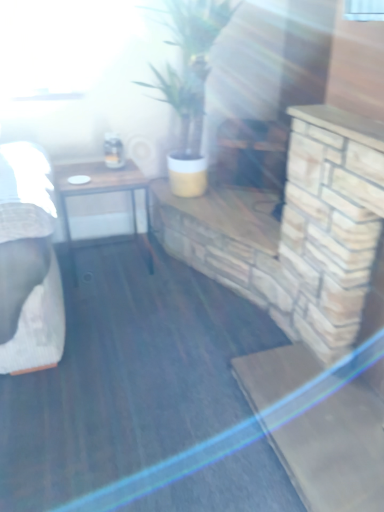
Find the location of `green matte plant at center`. green matte plant at center is located at coordinates (190, 85).

The height and width of the screenshot is (512, 384). Describe the element at coordinates (190, 85) in the screenshot. I see `green matte plant at center` at that location.

Where is `wooden table at left`? The width and height of the screenshot is (384, 512). wooden table at left is located at coordinates (98, 192).

The image size is (384, 512). What do you see at coordinates (98, 192) in the screenshot? I see `wooden table at left` at bounding box center [98, 192].

Where is `green matte plant at center`? The width and height of the screenshot is (384, 512). green matte plant at center is located at coordinates pos(190,85).

Which is more to the left, green matte plant at center or wooden table at left?

wooden table at left.

Is the position of green matte plant at center less distant than that of wooden table at left?

Yes, green matte plant at center is in front of wooden table at left.

Which is less distant, (187, 19) or (133, 182)?

Clearly, point (187, 19) is more distant from the camera than point (133, 182).

From the image's perspective, is green matte plant at center over wooden table at left?

Yes, from the image's perspective, green matte plant at center is over wooden table at left.

From a real-world perspective, does green matte plant at center sit lower than wooden table at left?

No.

Can you confirm if green matte plant at center is wider than wooden table at left?

Yes, green matte plant at center is wider than wooden table at left.

From their relative heights in the image, would you say green matte plant at center is taller or shorter than wooden table at left?

green matte plant at center is taller than wooden table at left.

Who is bigger, green matte plant at center or wooden table at left?

With larger size is green matte plant at center.

Could wooden table at left be considered to be inside green matte plant at center?

No, wooden table at left is not surrounded by green matte plant at center.

Does green matte plant at center touch wooden table at left?

There is a gap between green matte plant at center and wooden table at left.

Based on the photo, could you tell me if green matte plant at center is turned towards wooden table at left?

No, green matte plant at center is not aimed at wooden table at left.

Locate an element on the screen. The image size is (384, 512). houseplant in front of the wooden table at left is located at coordinates (190, 85).

Can you confirm if wooden table at left is positioned to the left of green matte plant at center?

Yes.

Is the depth of wooden table at left greater than that of green matte plant at center?

Yes, wooden table at left is further from the camera.

Is point (123, 176) behind point (164, 92)?

No, (123, 176) is in front of (164, 92).

From the image's perspective, between wooden table at left and green matte plant at center, who is located below?

wooden table at left.

From a real-world perspective, is wooden table at left physically above green matte plant at center?

No, from a real-world perspective, wooden table at left is not over green matte plant at center

Considering the relative sizes of wooden table at left and green matte plant at center in the image provided, is wooden table at left wider than green matte plant at center?

Incorrect, the width of wooden table at left does not surpass that of green matte plant at center.

Between wooden table at left and green matte plant at center, which one has less height?

wooden table at left.

Can you confirm if wooden table at left is smaller than green matte plant at center?

Yes, wooden table at left is smaller than green matte plant at center.

Choose the correct answer: Is wooden table at left inside green matte plant at center or outside it?

wooden table at left lies outside green matte plant at center.

Are wooden table at left and green matte plant at center making contact?

wooden table at left is not next to green matte plant at center, and they're not touching.

Could you tell me if wooden table at left is turned towards green matte plant at center?

No.

What's the angular difference between wooden table at left and green matte plant at center's facing directions?

0.954 degrees.

You are a GUI agent. You are given a task and a screenshot of the screen. Output one action in this format:
    pyautogui.click(x=<x>, y=<y>)
    Task: Click on the table that is behind the green matte plant at center
    The image size is (384, 512).
    Given the screenshot: What is the action you would take?
    pyautogui.click(x=98, y=192)

Identify the location of table beneath the green matte plant at center (from a real-world perspective). The width and height of the screenshot is (384, 512). (98, 192).

Find the location of a particular element. The image size is (384, 512). table behind the green matte plant at center is located at coordinates (98, 192).